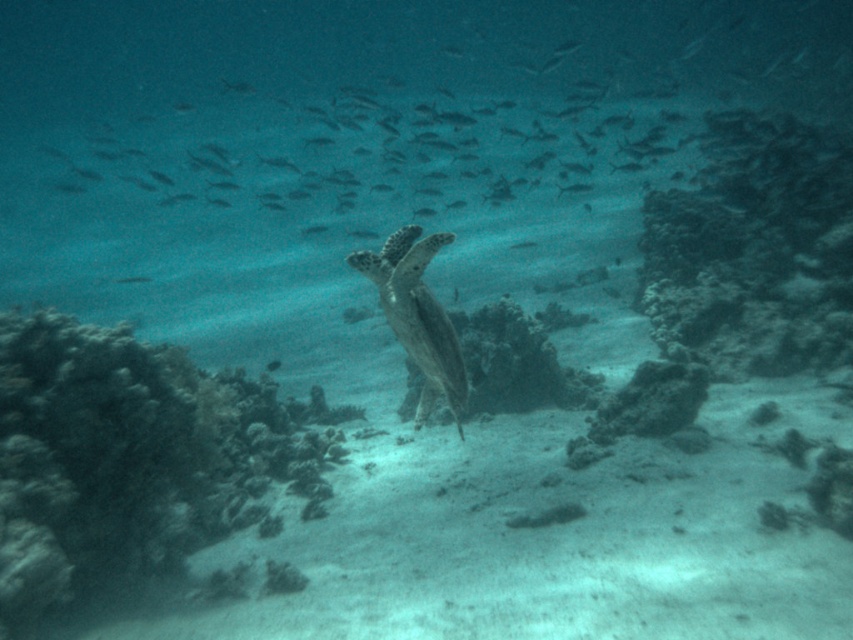
Question: Can you confirm if greenish-gray textured turtle at center is smaller than translucent greenish fish at center?

Choices:
 (A) no
 (B) yes

Answer: (A)

Question: Which object is the farthest from the translucent greenish fish at center?

Choices:
 (A) greenish-gray textured turtle at center
 (B) translucent greenish-blue fish at upper center

Answer: (B)

Question: Which of the following is the farthest from the observer?

Choices:
 (A) dark green coral reef at lower left
 (B) greenish-gray textured turtle at center
 (C) translucent greenish fish at center

Answer: (C)

Question: Which point is farther from the camera taking this photo?

Choices:
 (A) (138, 282)
 (B) (366, 253)
 (C) (181, 381)
 (D) (822, 84)

Answer: (D)

Question: Is dark green coral reef at lower left thinner than greenish-gray textured turtle at center?

Choices:
 (A) yes
 (B) no

Answer: (B)

Question: Does dark green coral reef at lower left have a smaller size compared to greenish-gray textured turtle at center?

Choices:
 (A) yes
 (B) no

Answer: (B)